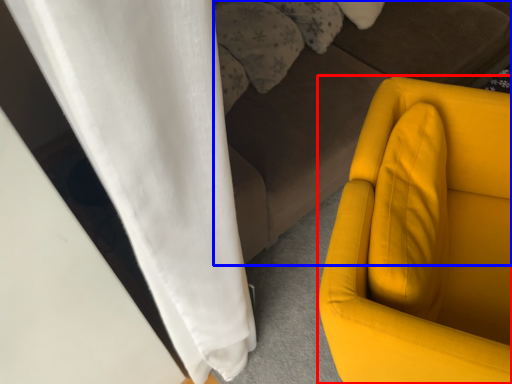
Question: Which object is closer to the camera taking this photo, furniture (highlighted by a red box) or studio couch (highlighted by a blue box)?

Choices:
 (A) furniture
 (B) studio couch

Answer: (A)